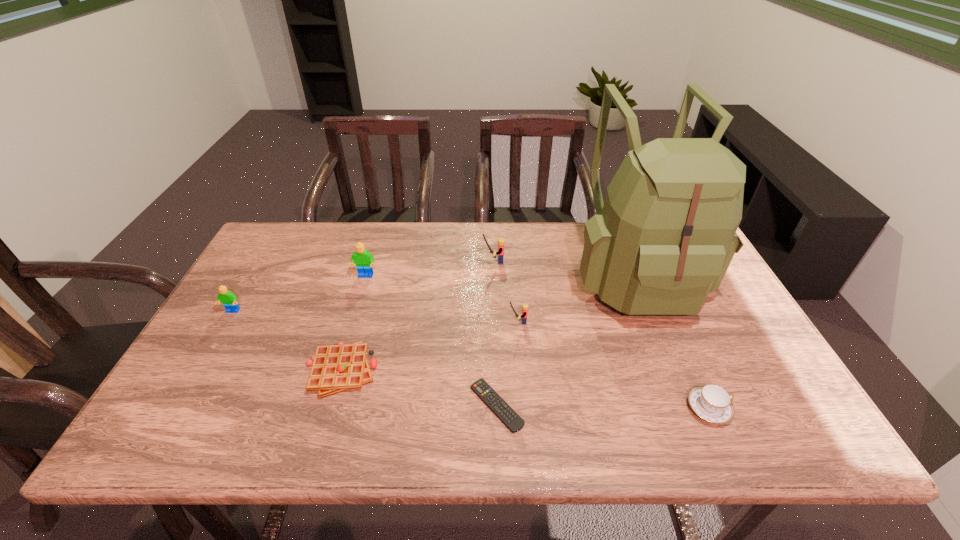
This screenshot has width=960, height=540. I want to click on object that is positioned at the left edge, so click(229, 300).

This screenshot has height=540, width=960. Find the location of `backpack that is at the right edge`. backpack that is at the right edge is located at coordinates (664, 237).

This screenshot has height=540, width=960. In order to click on teacup at the right edge in this screenshot , I will do (x=711, y=402).

Where is `object situated at the far right corner`? object situated at the far right corner is located at coordinates (664, 237).

The height and width of the screenshot is (540, 960). What are the coordinates of `object that is at the near right corner` in the screenshot? It's located at (711, 402).

The width and height of the screenshot is (960, 540). I want to click on free point at the far edge, so click(320, 238).

The width and height of the screenshot is (960, 540). In the image, there is a desktop. What are the coordinates of `free space at the near edge` in the screenshot? It's located at (601, 446).

You are a GUI agent. You are given a task and a screenshot of the screen. Output one action in this format:
    pyautogui.click(x=<x>, y=<y>)
    Task: Click on the free point at the left edge
    The height and width of the screenshot is (540, 960).
    Given the screenshot: What is the action you would take?
    pyautogui.click(x=261, y=266)

Identify the location of free region at the right edge of the desktop. (720, 292).

This screenshot has height=540, width=960. I want to click on free spot at the near right corner of the desktop, so click(x=755, y=449).